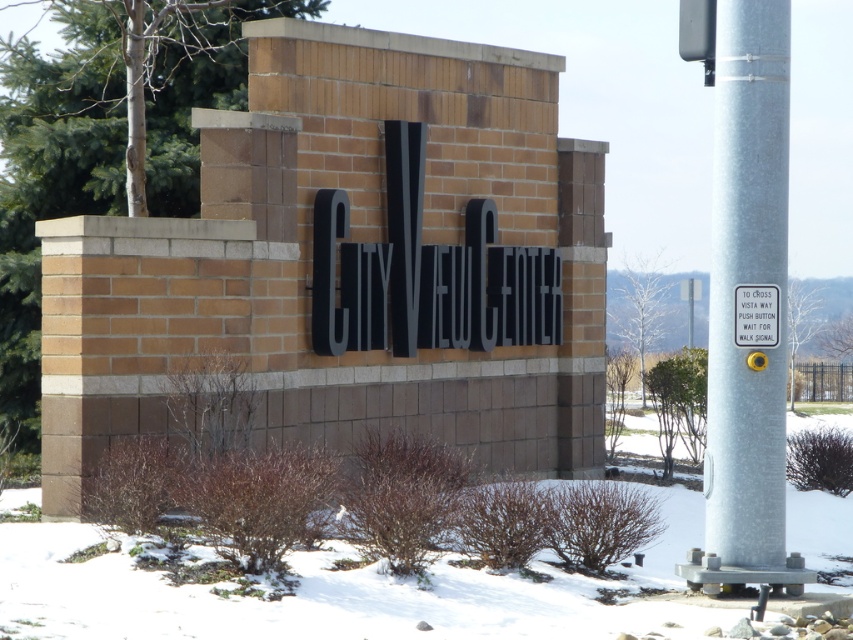
You are a city planner reviewing the layout of a pedestrian area. The silver metallic pole at right and the white plastic sign at upper right are both in the proposed design. Based on the image, which object is taller?

The silver metallic pole at right is taller than the white plastic sign at upper right according to the description.

Based on the photo, you are a delivery person trying to read the white plastic sign at upper right but the white powdery snow at center is blocking your view. Can you move the snow to get a clear view of the sign?

The white powdery snow at center is in front of the white plastic sign at upper right, so moving the snow would allow you to see the sign clearly.

You are standing in front of the brick sign at CITY VIEW CENTER. There are two points marked on the sign. One is at coordinate point (167, 604) and the other is at point (711, 60). If you want to touch the point that is closer to your face, which coordinate should you aim for?

You should aim for point (167, 604) because it is closer to the camera than point (711, 60).